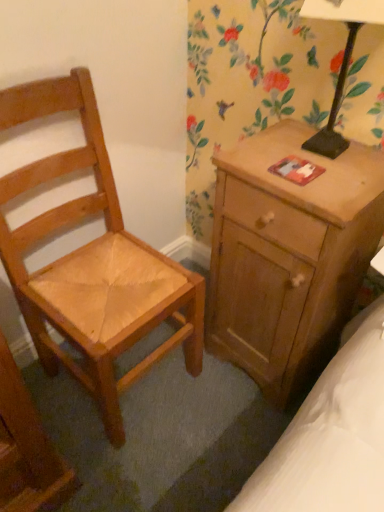
Find the location of `free space above wooden nightstand at right (from a real-world perspective)`. free space above wooden nightstand at right (from a real-world perspective) is located at coordinates (306, 163).